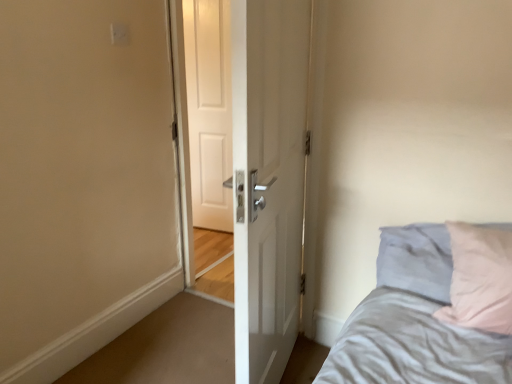
Question: Can you confirm if white matte door at center is positioned to the right of white plastic electric outlet at upper center?

Choices:
 (A) yes
 (B) no

Answer: (A)

Question: Does white matte door at center have a smaller size compared to white plastic electric outlet at upper center?

Choices:
 (A) yes
 (B) no

Answer: (B)

Question: From the image's perspective, is white matte door at center below white plastic electric outlet at upper center?

Choices:
 (A) no
 (B) yes

Answer: (B)

Question: Does white matte door at center have a lesser height compared to white plastic electric outlet at upper center?

Choices:
 (A) no
 (B) yes

Answer: (A)

Question: From a real-world perspective, is white matte door at center located higher than white plastic electric outlet at upper center?

Choices:
 (A) no
 (B) yes

Answer: (A)

Question: Considering the positions of white matte door at center and white glossy door at center in the image, is white matte door at center wider or thinner than white glossy door at center?

Choices:
 (A) wide
 (B) thin

Answer: (B)

Question: Relative to white glossy door at center, is white matte door at center in front or behind?

Choices:
 (A) front
 (B) behind

Answer: (B)

Question: Is white matte door at center inside or outside of white glossy door at center?

Choices:
 (A) inside
 (B) outside

Answer: (B)

Question: Is point (203, 36) positioned closer to the camera than point (261, 167)?

Choices:
 (A) farther
 (B) closer

Answer: (A)

Question: Considering the positions of white glossy door at center and white plastic electric outlet at upper center in the image, is white glossy door at center wider or thinner than white plastic electric outlet at upper center?

Choices:
 (A) thin
 (B) wide

Answer: (B)

Question: Does point (242, 215) appear closer or farther from the camera than point (114, 29)?

Choices:
 (A) farther
 (B) closer

Answer: (B)

Question: In terms of height, does white glossy door at center look taller or shorter compared to white plastic electric outlet at upper center?

Choices:
 (A) short
 (B) tall

Answer: (B)

Question: From the image's perspective, is white glossy door at center positioned above or below white plastic electric outlet at upper center?

Choices:
 (A) above
 (B) below

Answer: (B)

Question: Visually, is white matte door at center positioned to the left or to the right of white plastic electric outlet at upper center?

Choices:
 (A) left
 (B) right

Answer: (B)

Question: Is white matte door at center situated inside white plastic electric outlet at upper center or outside?

Choices:
 (A) inside
 (B) outside

Answer: (B)